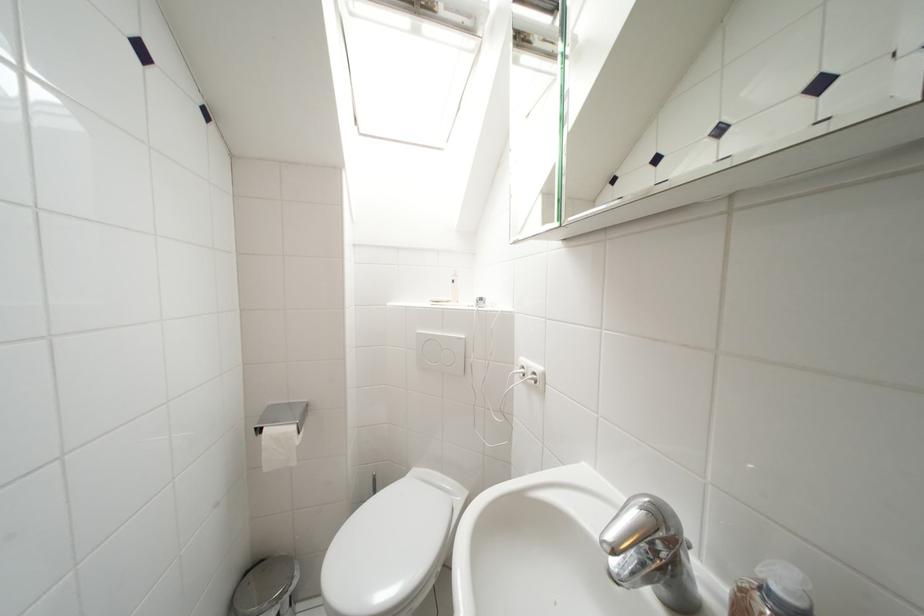
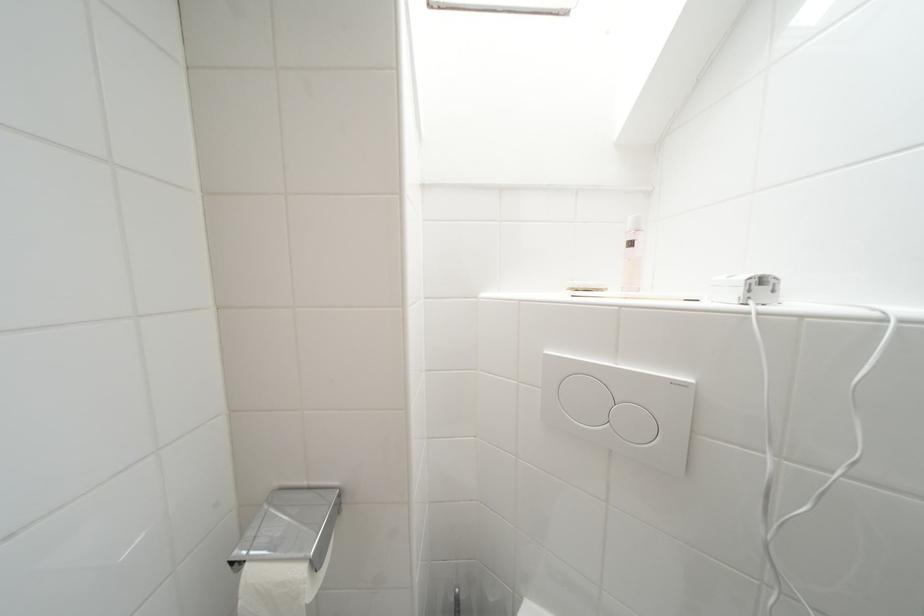
Find the pixel in the second image that matches pixel 488 302 in the first image.

(769, 283)